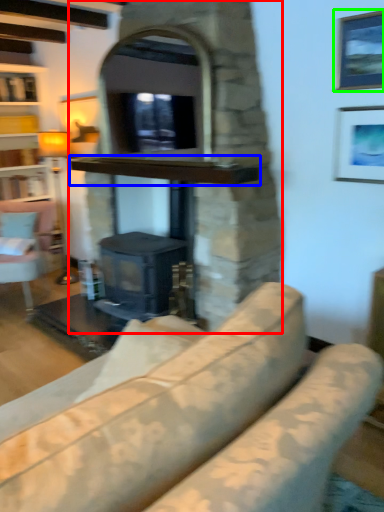
Question: Estimate the real-world distances between objects in this image. Which object is closer to fireplace (highlighted by a red box), mantle (highlighted by a blue box) or picture frame (highlighted by a green box)?

Choices:
 (A) mantle
 (B) picture frame

Answer: (A)